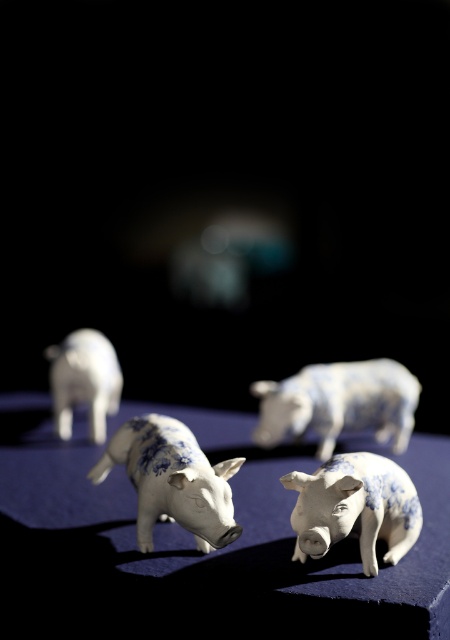
Does blue and white porcelain pig at center have a lesser height compared to white glossy pig at left?

Indeed, blue and white porcelain pig at center has a lesser height compared to white glossy pig at left.

This screenshot has width=450, height=640. What do you see at coordinates (338, 403) in the screenshot?
I see `blue and white porcelain pig at center` at bounding box center [338, 403].

What are the coordinates of `blue and white porcelain pig at center` in the screenshot? It's located at (338, 403).

Between blue and white ceramic pig at center and blue and white porcelain pig at center, which one has less height?

With less height is blue and white ceramic pig at center.

Is blue and white ceramic pig at center wider than blue and white porcelain pig at center?

No, blue and white ceramic pig at center is not wider than blue and white porcelain pig at center.

Image resolution: width=450 pixels, height=640 pixels. What do you see at coordinates (172, 481) in the screenshot?
I see `blue and white ceramic pig at center` at bounding box center [172, 481].

This screenshot has width=450, height=640. Identify the location of blue and white ceramic pig at center. (172, 481).

Is blue and white ceramic pig at center below porcelain pig at center?

Incorrect, blue and white ceramic pig at center is not positioned below porcelain pig at center.

Who is more forward, (185, 442) or (413, 532)?

Positioned in front is point (413, 532).

Does point (175, 458) come farther from viewer compared to point (377, 467)?

That is True.

Identify the location of blue and white ceramic pig at center. The width and height of the screenshot is (450, 640). (172, 481).